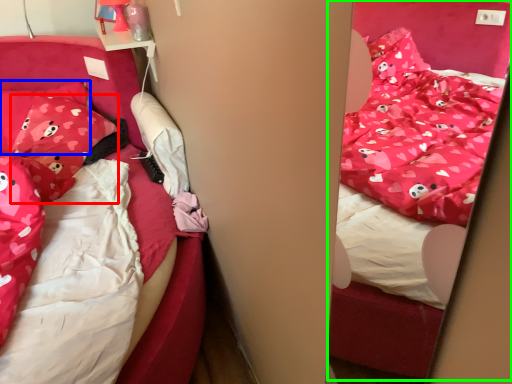
Question: Estimate the real-world distances between objects in this image. Which object is closer to pillow (highlighted by a red box), pillow (highlighted by a blue box) or bed (highlighted by a green box)?

Choices:
 (A) pillow
 (B) bed

Answer: (A)